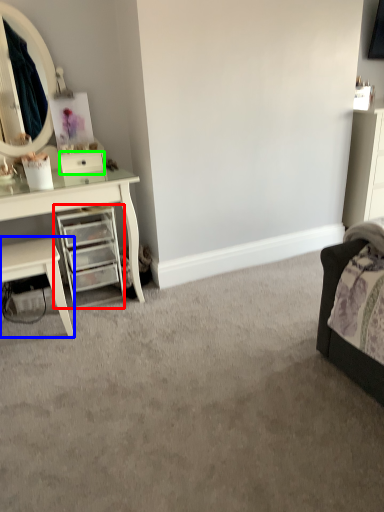
Question: Considering the real-world distances, which object is farthest from chest of drawers (highlighted by a red box)? nightstand (highlighted by a blue box) or drawer (highlighted by a green box)?

Choices:
 (A) nightstand
 (B) drawer

Answer: (B)